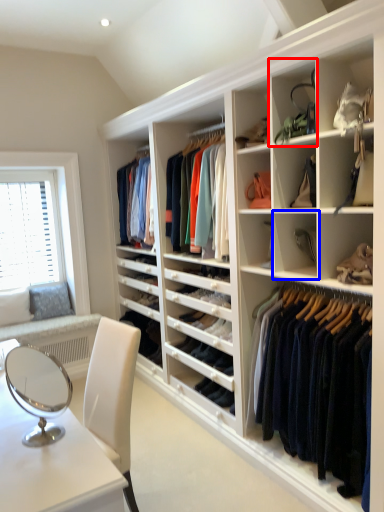
Question: Among these objects, which one is nearest to the camera, shelf (highlighted by a red box) or shelf (highlighted by a blue box)?

Choices:
 (A) shelf
 (B) shelf

Answer: (A)